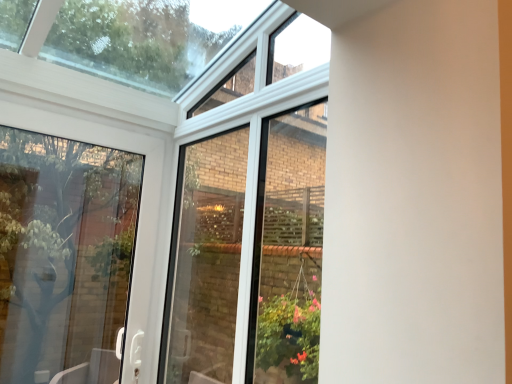
Question: Should I look upward or downward to see white glossy screen door at center?

Choices:
 (A) down
 (B) up

Answer: (A)